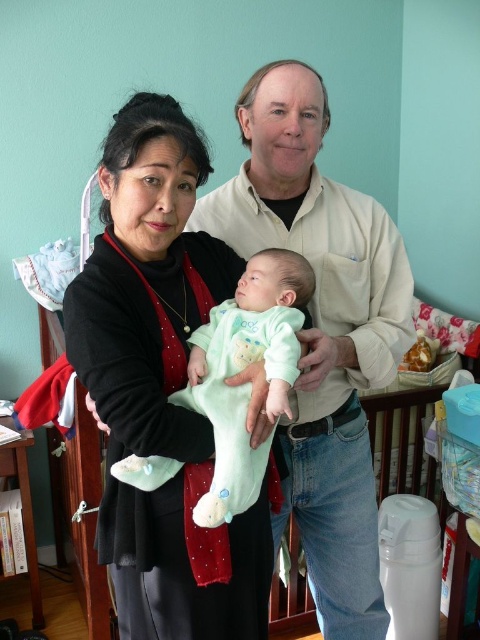
You are trying to determine the order of the two clothing items in the scene. Which clothing item is closer to you between the black matte sweater at center and the light beige cotton shirt at center?

The black matte sweater at center is closer to you because it is in front of the light beige cotton shirt at center.

You are a photographer trying to capture a candid shot of the black matte sweater at center. To ensure the subject is in focus, you need to know the distance between the photographer and the sweater. Can you determine if the distance is within your camera lens range of 30 inches?

The distance between the photographer and the black matte sweater at center is 38.19 inches, which exceeds the camera lens range of 30 inches. Therefore, the sweater is out of focus.